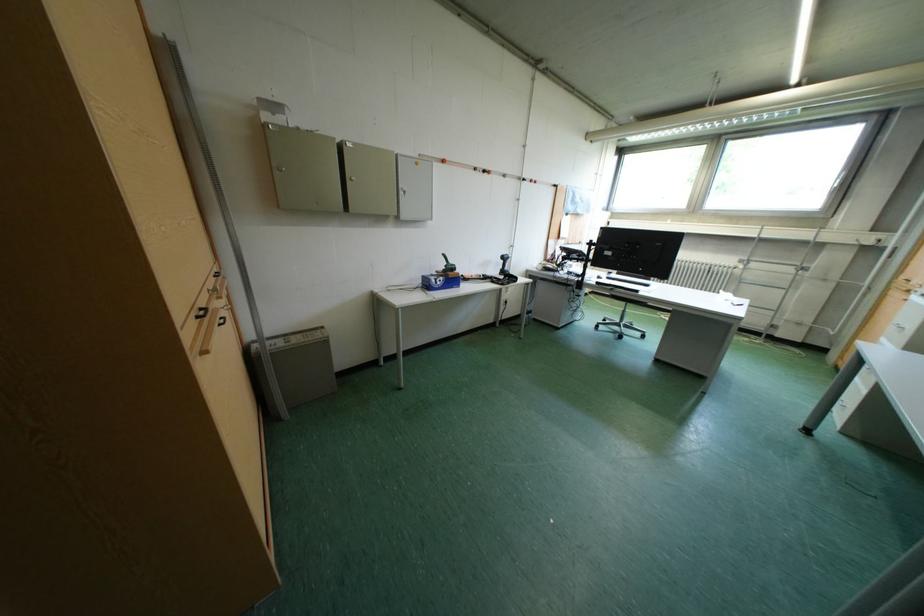
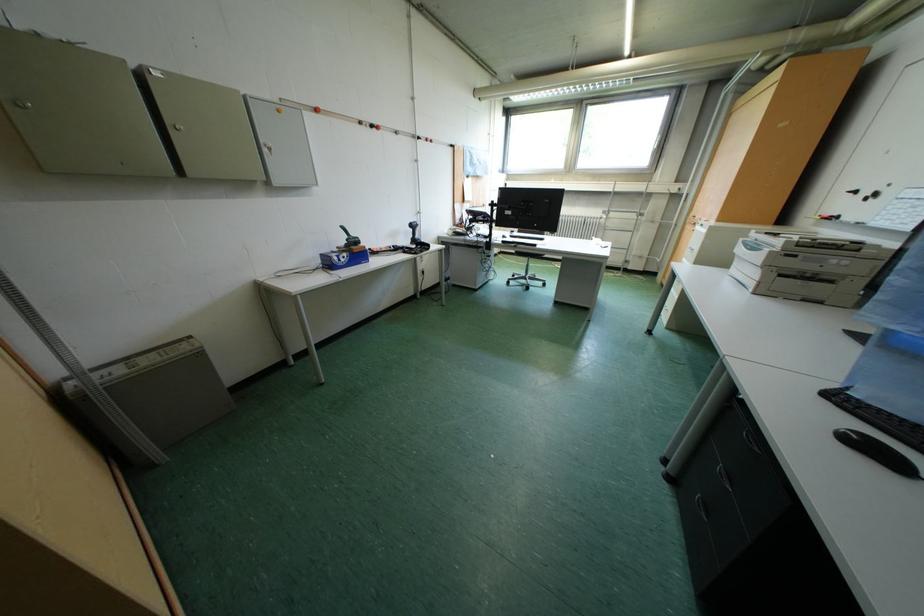
Consider the image. What movement of the cameraman would produce the second image?

The movement direction of the cameraman is right, forward.